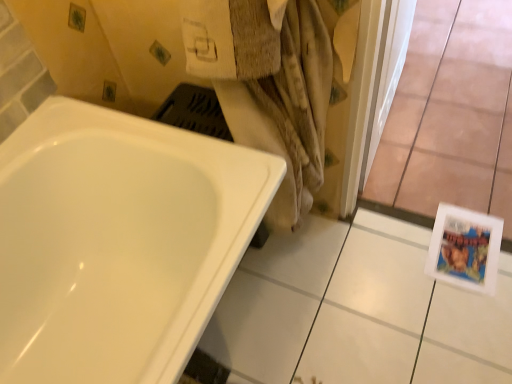
Where is `blank space situated above white glossy tile at lower right (from a real-world perspective)`? This screenshot has height=384, width=512. blank space situated above white glossy tile at lower right (from a real-world perspective) is located at coordinates (367, 302).